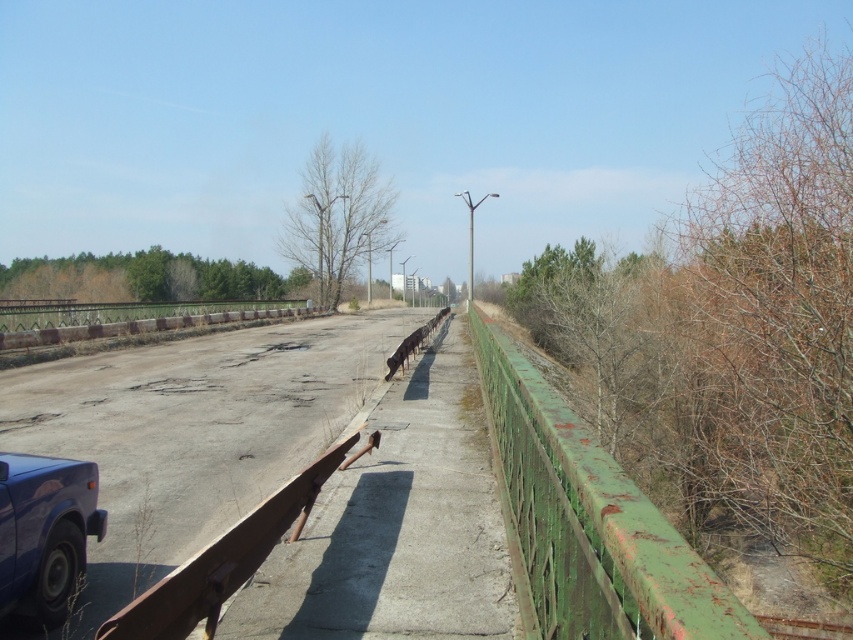
Is rusty green fence at right taller than matte blue car at lower left?

Yes, rusty green fence at right is taller than matte blue car at lower left.

At what (x,y) coordinates should I click in order to perform the action: click on rusty green fence at right. Please return your answer as a coordinate pair (x, y). Looking at the image, I should click on (587, 522).